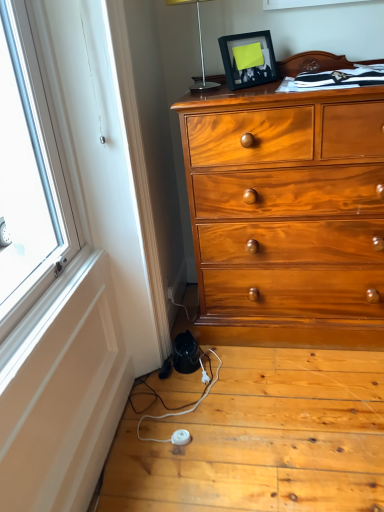
Question: Is black matte picture frame at upper center closer to camera compared to silver metallic table lamp at upper center?

Choices:
 (A) yes
 (B) no

Answer: (B)

Question: Is black matte picture frame at upper center positioned with its back to silver metallic table lamp at upper center?

Choices:
 (A) yes
 (B) no

Answer: (A)

Question: From a real-world perspective, is black matte picture frame at upper center on silver metallic table lamp at upper center?

Choices:
 (A) yes
 (B) no

Answer: (B)

Question: Considering the relative sizes of black matte picture frame at upper center and silver metallic table lamp at upper center in the image provided, is black matte picture frame at upper center bigger than silver metallic table lamp at upper center?

Choices:
 (A) yes
 (B) no

Answer: (B)

Question: Are black matte picture frame at upper center and silver metallic table lamp at upper center beside each other?

Choices:
 (A) yes
 (B) no

Answer: (B)

Question: Relative to white plastic power strip at lower center, is silver metallic table lamp at upper center in front or behind?

Choices:
 (A) behind
 (B) front

Answer: (A)

Question: Do you think silver metallic table lamp at upper center is within white plastic power strip at lower center, or outside of it?

Choices:
 (A) inside
 (B) outside

Answer: (B)

Question: Considering the positions of silver metallic table lamp at upper center and white plastic power strip at lower center in the image, is silver metallic table lamp at upper center wider or thinner than white plastic power strip at lower center?

Choices:
 (A) thin
 (B) wide

Answer: (A)

Question: From the image's perspective, relative to white plastic power strip at lower center, is silver metallic table lamp at upper center above or below?

Choices:
 (A) above
 (B) below

Answer: (A)

Question: Would you say white plastic power strip at lower center is inside or outside black matte picture frame at upper center?

Choices:
 (A) outside
 (B) inside

Answer: (A)

Question: Looking at their shapes, would you say white plastic power strip at lower center is wider or thinner than black matte picture frame at upper center?

Choices:
 (A) wide
 (B) thin

Answer: (A)

Question: From a real-world perspective, is white plastic power strip at lower center physically located above or below black matte picture frame at upper center?

Choices:
 (A) above
 (B) below

Answer: (B)

Question: From the image's perspective, is white plastic power strip at lower center above or below black matte picture frame at upper center?

Choices:
 (A) above
 (B) below

Answer: (B)

Question: Based on their positions, is black matte picture frame at upper center located to the left or right of white plastic power strip at lower center?

Choices:
 (A) right
 (B) left

Answer: (A)

Question: Is black matte picture frame at upper center bigger or smaller than white plastic power strip at lower center?

Choices:
 (A) big
 (B) small

Answer: (B)